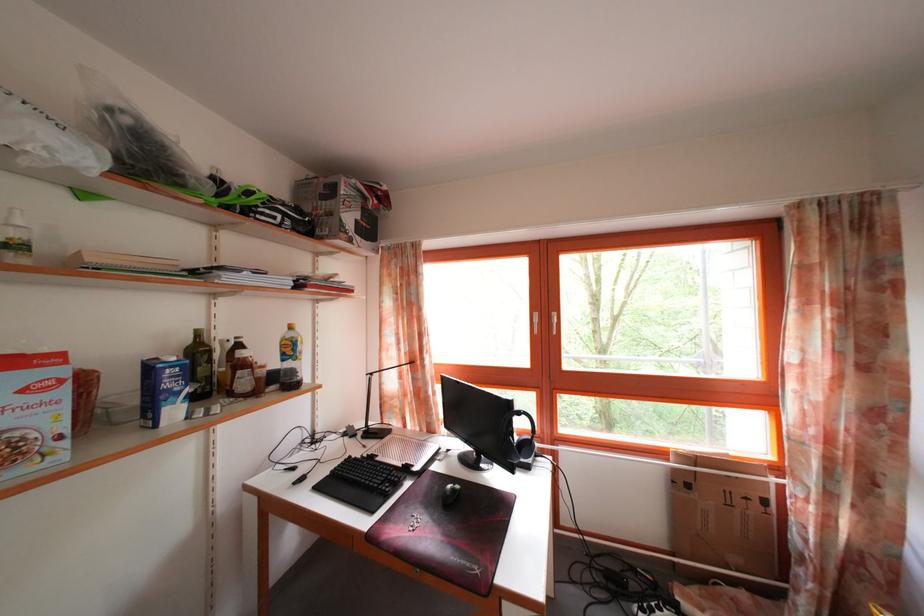
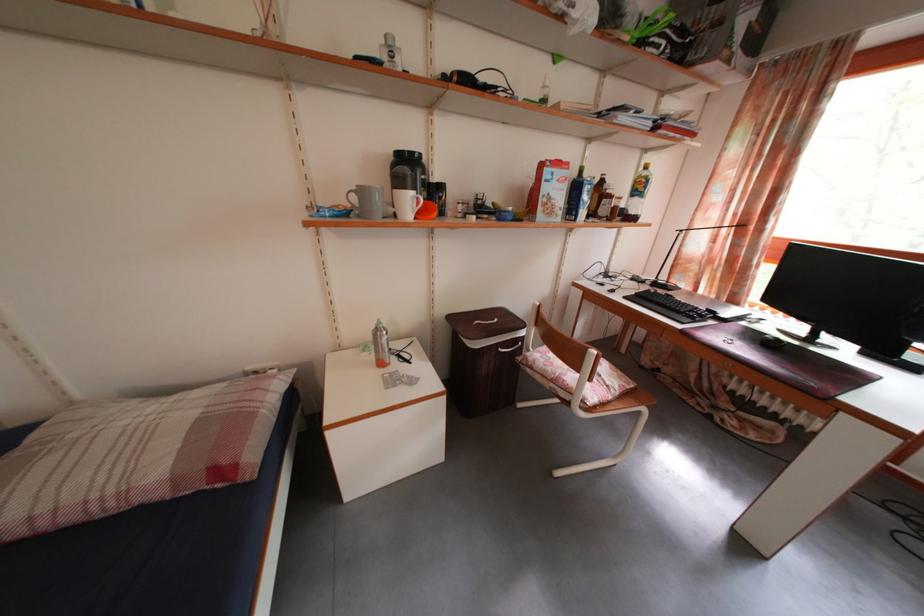
Locate, in the second image, the point that corresponds to pixel 315 312 in the first image.

(643, 161)